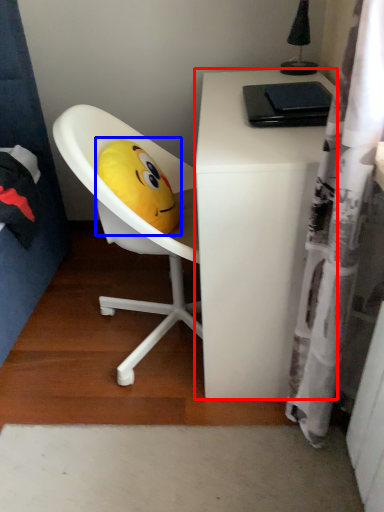
Question: Which of the following is the farthest to the observer, desk (highlighted by a red box) or toy (highlighted by a blue box)?

Choices:
 (A) desk
 (B) toy

Answer: (B)